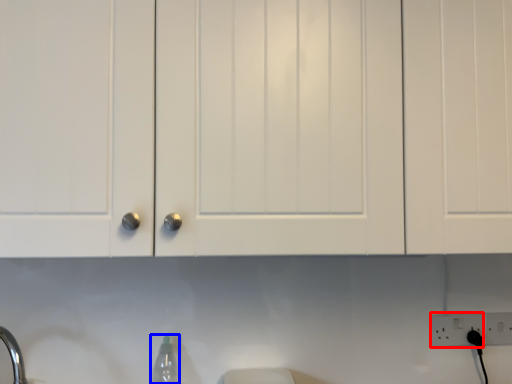
Question: Which object appears closest to the camera in this image, electric outlet (highlighted by a red box) or bottle (highlighted by a blue box)?

Choices:
 (A) electric outlet
 (B) bottle

Answer: (B)